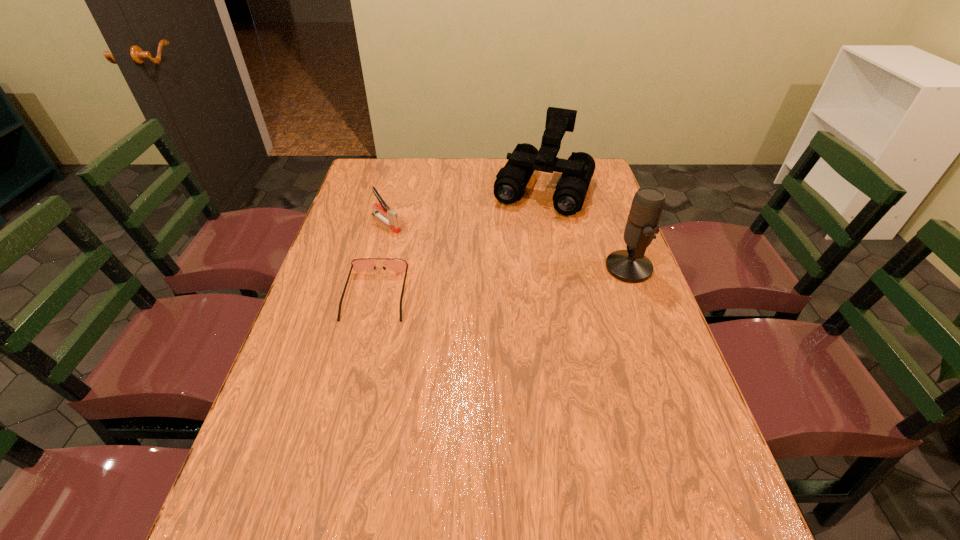
This screenshot has height=540, width=960. I want to click on vacant space on the desktop that is between the shortest object and the microphone and is positioned on the handle side of the stapler, so click(x=469, y=285).

At what (x,y) coordinates should I click in order to perform the action: click on vacant spot on the desktop that is between the shortest object and the microphone and is positioned on the front lenses of the binoculars. Please return your answer as a coordinate pair (x, y). Looking at the image, I should click on (501, 281).